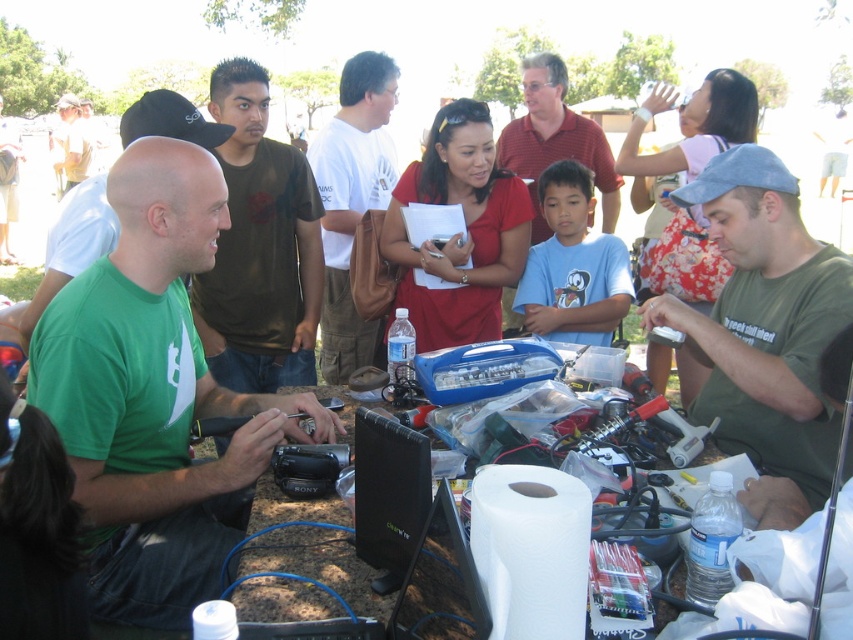
You are standing in the park and looking at the table with all the items. There are two points marked on the table. Which point is closer to you, point at coordinate (247, 404) or point at coordinate (566, 588)?

Point at coordinate (247, 404) is closer to you because it is further to the camera than point at coordinate (566, 588).

In the scene described, there is a green matte shirt at center and a white paper towel at lower center. From the perspective of someone standing at the table, which object is positioned to the left?

The green matte shirt at center is to the left of the white paper towel at lower center.

You are planning to deliver a small tool from the matte red polo shirt at center to the matte khaki shirt at upper left. Given that the shortest path between them is 27.85 feet, and you have a drone that can carry the tool but has a maximum range of 25 feet. Can the drone successfully deliver the tool?

The distance between the matte red polo shirt at center and the matte khaki shirt at upper left is 27.85 feet, which exceeds the drone s maximum range of 25 feet. Therefore, the drone cannot successfully deliver the tool.